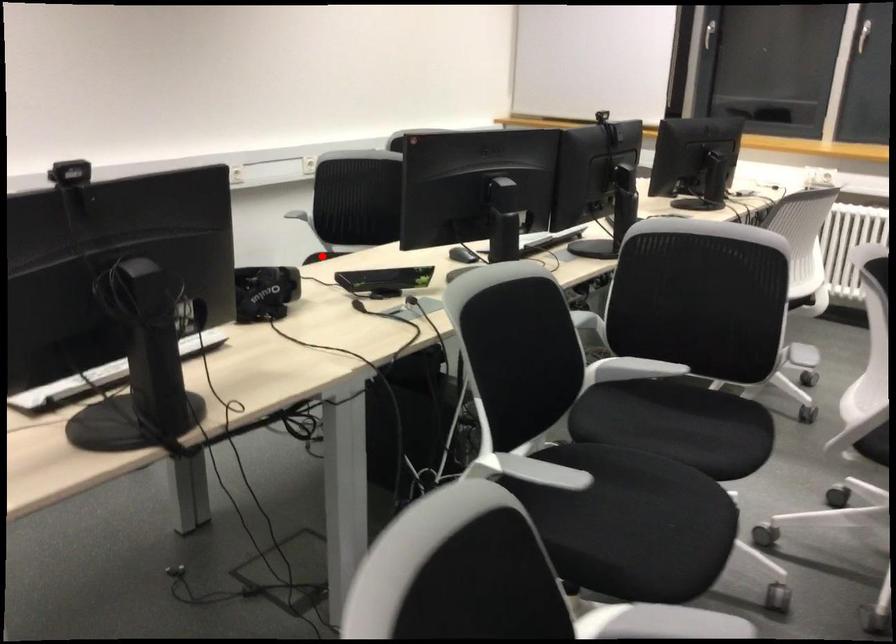
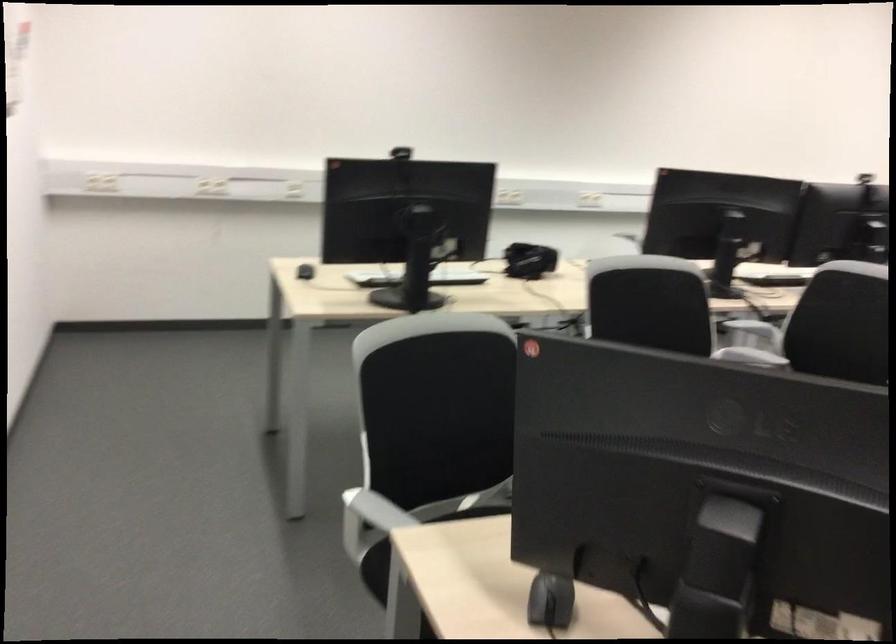
Question: I am providing you with two images of the same scene from different viewpoints. A red point is marked on the first image. Is the red point's position out of view in image 2?

Choices:
 (A) Yes
 (B) No

Answer: (A)